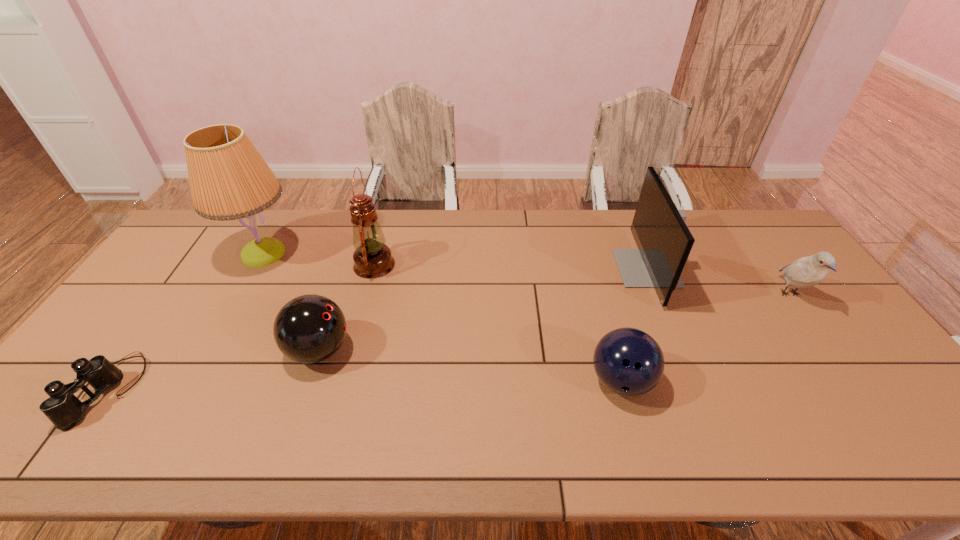
Identify the location of free space between the bird and the right bowling ball. (706, 338).

Find the location of `the sixth closest object relative to the bird`. the sixth closest object relative to the bird is located at coordinates (62, 408).

Where is `object that is the fourth nearest to the tallest object`? object that is the fourth nearest to the tallest object is located at coordinates (629, 362).

Find the location of a particular element. free space that satisfies the following two spatial constraints: 1. on the screen of the second object from right to left; 2. on the front side of the leftmost object is located at coordinates (696, 390).

What are the coordinates of `vacant area that satisfies the following two spatial constraints: 1. at the beak of the rightmost object; 2. on the surface of the left bowling ball near the finger holes` in the screenshot? It's located at (830, 350).